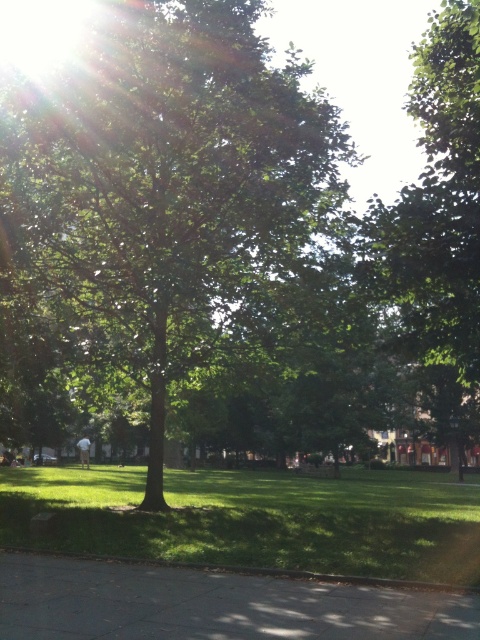
Who is positioned more to the left, gray concrete pavement at lower center or green leafy tree at upper center?

gray concrete pavement at lower center

Can you confirm if gray concrete pavement at lower center is positioned to the left of green leafy tree at upper center?

Correct, you'll find gray concrete pavement at lower center to the left of green leafy tree at upper center.

Where is `gray concrete pavement at lower center`? Image resolution: width=480 pixels, height=640 pixels. gray concrete pavement at lower center is located at coordinates (213, 604).

Is green leafy tree at center taller than green grass at lower left?

Yes.

Which of these two, green leafy tree at center or green grass at lower left, stands taller?

Standing taller between the two is green leafy tree at center.

Between point (334, 193) and point (471, 570), which one is positioned behind?

Point (334, 193)

Identify the location of green leafy tree at center. (165, 184).

Does point (370, 566) come behind point (168, 616)?

Yes, it is behind point (168, 616).

In order to click on green grass at lower left in this screenshot , I will do `click(255, 518)`.